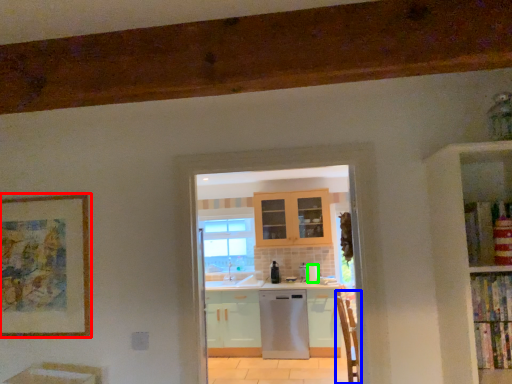
Question: Based on their relative distances, which object is nearer to picture frame (highlighted by a red box)? Choose from armchair (highlighted by a blue box) and appliance (highlighted by a green box).

Choices:
 (A) armchair
 (B) appliance

Answer: (A)